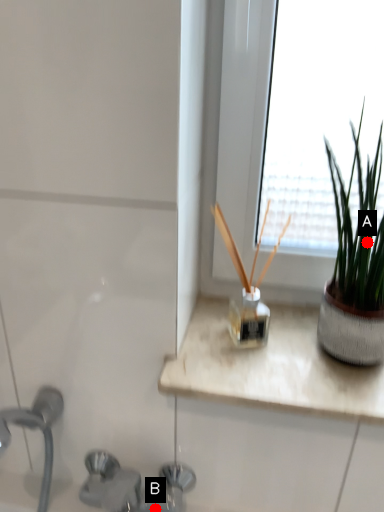
Question: Two points are circled on the image, labeled by A and B beside each circle. Which point is closer to the camera?

Choices:
 (A) A is closer
 (B) B is closer

Answer: (A)